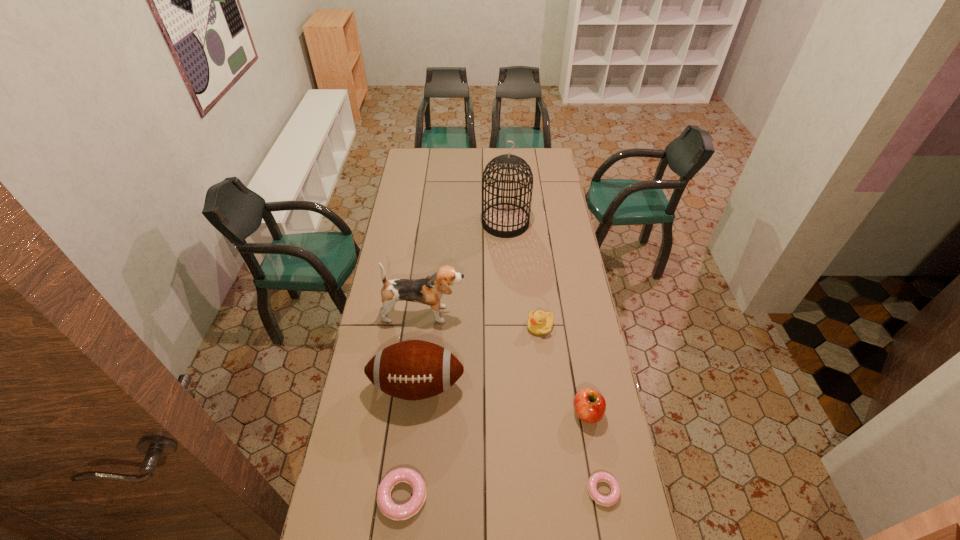
Identify the location of object that ranks as the fourth closest to the second tallest object. The image size is (960, 540). (589, 405).

The image size is (960, 540). Identify the location of object that stands as the fourth closest to the sixth tallest object. (429, 290).

Image resolution: width=960 pixels, height=540 pixels. I want to click on blank area in the image that satisfies the following two spatial constraints: 1. on the beak of the third shortest object; 2. on the front side of the taller doughnut, so click(560, 496).

Where is `vacant space that satisfies the following two spatial constraints: 1. on the beak of the duckling; 2. on the front side of the taller doughnut`? vacant space that satisfies the following two spatial constraints: 1. on the beak of the duckling; 2. on the front side of the taller doughnut is located at coordinates (560, 496).

At what (x,y) coordinates should I click in order to perform the action: click on vacant space that satisfies the following two spatial constraints: 1. on the laces of the right doughnut; 2. on the right side of the third tallest object. Please return your answer as a coordinate pair (x, y). The height and width of the screenshot is (540, 960). Looking at the image, I should click on (405, 490).

Locate an element on the screen. vacant space that satisfies the following two spatial constraints: 1. at the face of the sixth shortest object; 2. on the right side of the fourth tallest object is located at coordinates (413, 413).

Where is `free point that satisfies the following two spatial constraints: 1. on the back side of the fourth tallest object; 2. on the beak of the duckling`? The height and width of the screenshot is (540, 960). free point that satisfies the following two spatial constraints: 1. on the back side of the fourth tallest object; 2. on the beak of the duckling is located at coordinates (571, 326).

You are a GUI agent. You are given a task and a screenshot of the screen. Output one action in this format:
    pyautogui.click(x=<x>, y=<y>)
    Task: Click on the vacant region that satisfies the following two spatial constraints: 1. on the beak of the third shortest object; 2. on the laces of the fifth shortest object
    
    Given the screenshot: What is the action you would take?
    pyautogui.click(x=547, y=386)

Where is `free space in the image that satisfies the following two spatial constraints: 1. on the front side of the tallest object; 2. at the face of the second tallest object`? free space in the image that satisfies the following two spatial constraints: 1. on the front side of the tallest object; 2. at the face of the second tallest object is located at coordinates (511, 314).